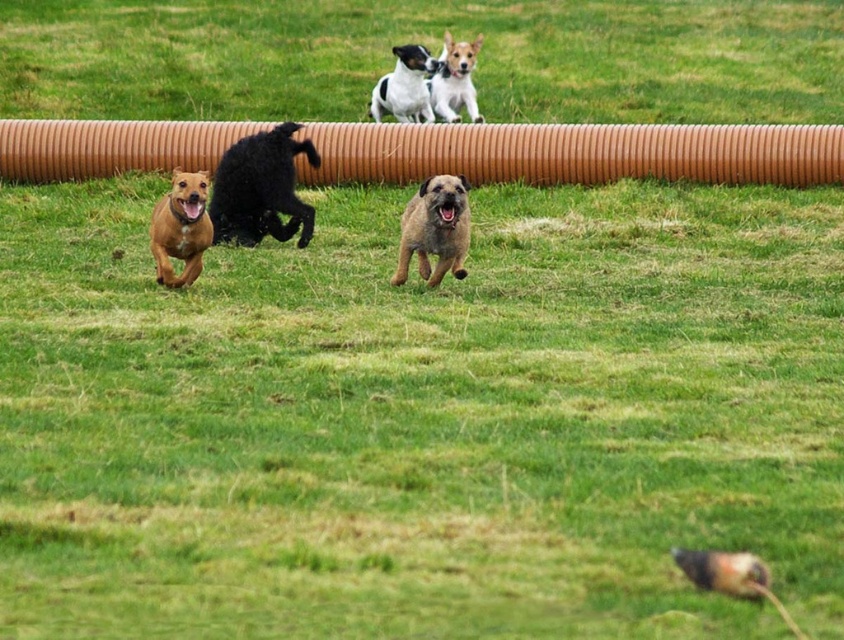
Is smooth tan dog at lower left positioned in front of smooth tan dog at upper center?

Yes, it is in front of smooth tan dog at upper center.

Which is more to the right, smooth tan dog at lower left or smooth tan dog at upper center?

From the viewer's perspective, smooth tan dog at upper center appears more on the right side.

The image size is (844, 640). Describe the element at coordinates (180, 228) in the screenshot. I see `smooth tan dog at lower left` at that location.

At what (x,y) coordinates should I click in order to perform the action: click on smooth tan dog at lower left. Please return your answer as a coordinate pair (x, y). Looking at the image, I should click on (180, 228).

Which of these two, shiny black dog at left or brown shaggy dog at center, stands taller?

With more height is shiny black dog at left.

Where is `shiny black dog at left`? The image size is (844, 640). shiny black dog at left is located at coordinates (261, 188).

The image size is (844, 640). In order to click on shiny black dog at left in this screenshot , I will do `click(261, 188)`.

Where is `brown shaggy dog at center`? Image resolution: width=844 pixels, height=640 pixels. brown shaggy dog at center is located at coordinates (436, 228).

Is the position of brown shaggy dog at center more distant than that of smooth tan dog at upper center?

No, it is not.

Find the location of a particular element. This screenshot has height=640, width=844. brown shaggy dog at center is located at coordinates (436, 228).